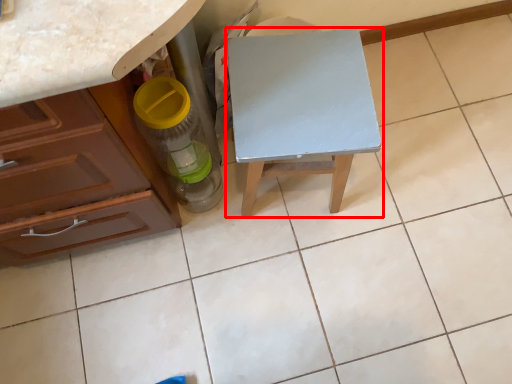
Question: From the image's perspective, where is table (annotated by the red box) located in relation to bottle in the image?

Choices:
 (A) above
 (B) below

Answer: (A)